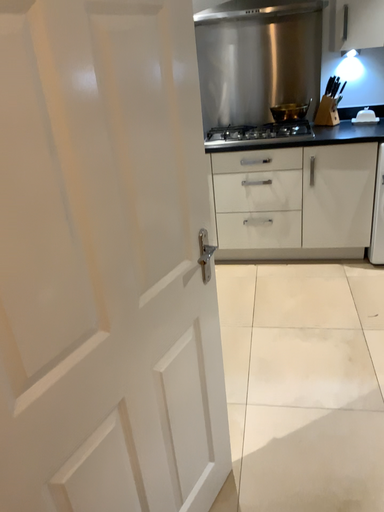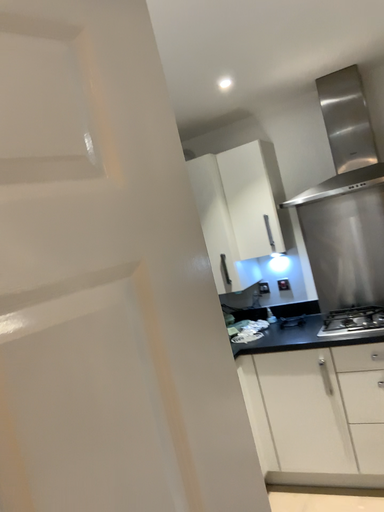
Question: Which way did the camera rotate in the video?

Choices:
 (A) rotated upward
 (B) rotated downward

Answer: (A)